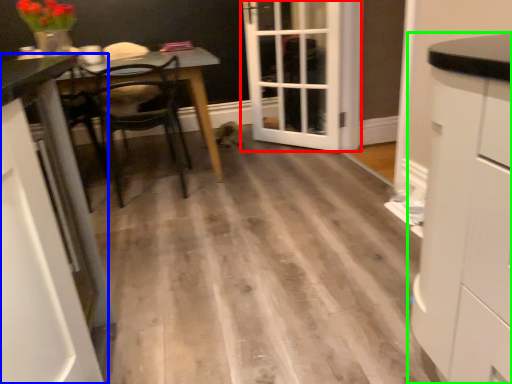
Question: Which object is the closest to the door (highlighted by a red box)? Choose among these: cabinetry (highlighted by a blue box) or cabinetry (highlighted by a green box).

Choices:
 (A) cabinetry
 (B) cabinetry

Answer: (B)